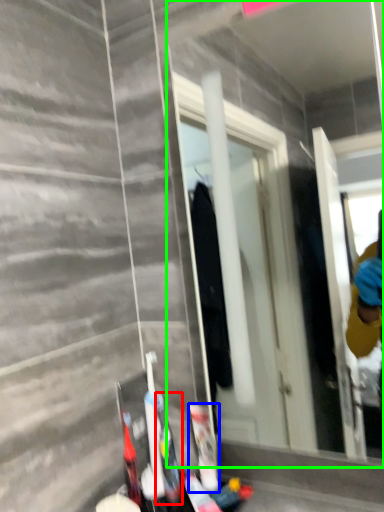
Question: Which object is positioned farthest from toiletry (highlighted by a red box)? Select from toiletry (highlighted by a blue box) and mirror (highlighted by a green box).

Choices:
 (A) toiletry
 (B) mirror

Answer: (B)